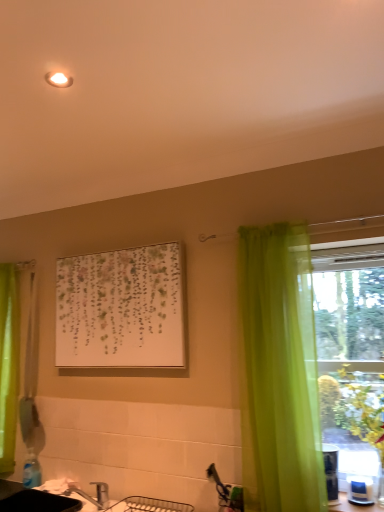
The width and height of the screenshot is (384, 512). I want to click on free space above green sheer curtain at left, placed as the second curtain when sorted from front to back (from a real-world perspective), so click(x=14, y=259).